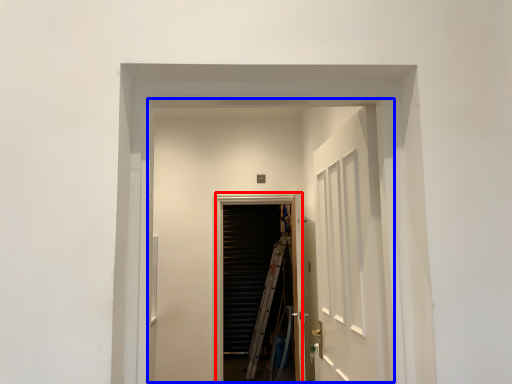
Question: Among these objects, which one is farthest to the camera, screen door (highlighted by a red box) or elevator (highlighted by a blue box)?

Choices:
 (A) screen door
 (B) elevator

Answer: (A)